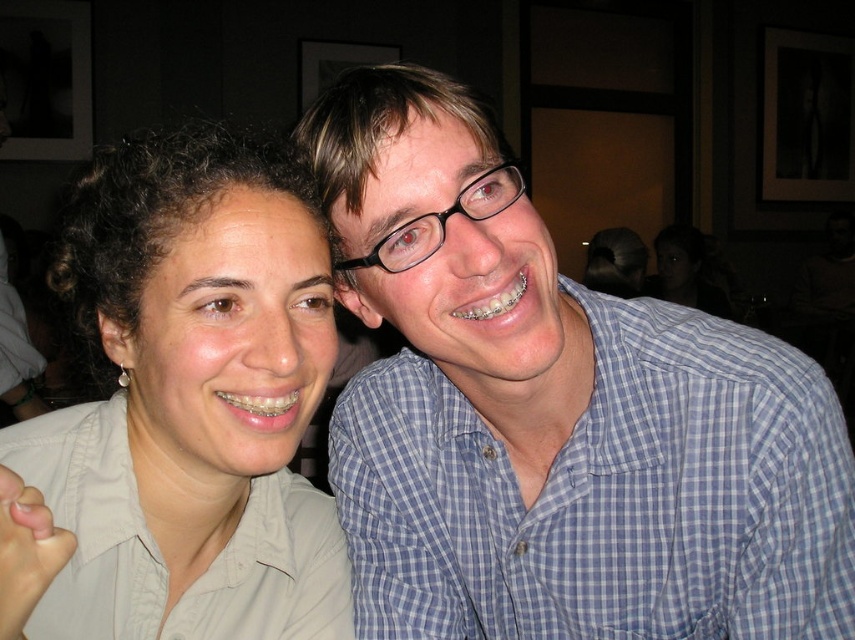
You are a photographer at a social event and need to adjust the camera focus. You see the matte khaki shirt at left and the blue checkered shirt at right. Which shirt should you focus on to ensure the taller one is in sharp detail?

The matte khaki shirt at left is much taller than the blue checkered shirt at right, so you should focus on the matte khaki shirt at left to ensure the taller one is in sharp detail.

You are a tailor who needs to adjust the size of the shirts in the image. The customer wants both the matte khaki shirt at left and the blue checkered shirt at right to be the same size. Which shirt should you shrink or expand?

The matte khaki shirt at left is bigger than the blue checkered shirt at right. To make them the same size, shrink the matte khaki shirt at left and expand the blue checkered shirt at right.

What are the coordinates of the matte khaki shirt at left?

The matte khaki shirt at left is located at coordinates point (181, 410).